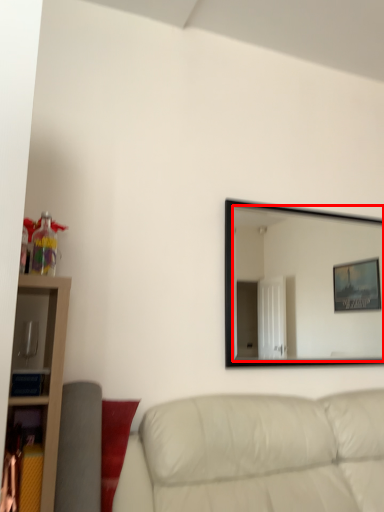
Question: From the image's perspective, where is mirror (annotated by the red box) located in relation to studio couch in the image?

Choices:
 (A) above
 (B) below

Answer: (A)